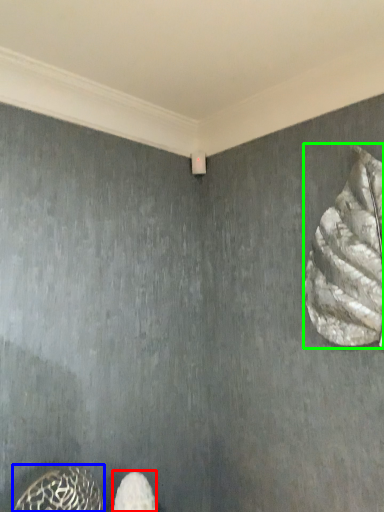
Question: Which object is the closest to the footwear (highlighted by a red box)? Choose among these: animal (highlighted by a blue box) or animal (highlighted by a green box).

Choices:
 (A) animal
 (B) animal

Answer: (A)